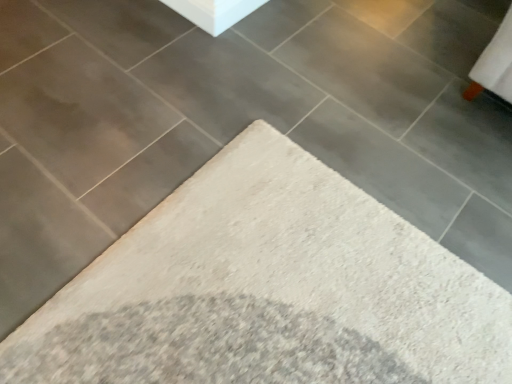
This screenshot has height=384, width=512. Identify the location of white shag rug at center. (268, 289).

What do you see at coordinates (268, 289) in the screenshot?
I see `white shag rug at center` at bounding box center [268, 289].

In order to face white smooth concrete at upper center, should I rotate leftwards or rightwards?

It's best to rotate left around 2.175 degrees.

Identify the location of white smooth concrete at upper center. Image resolution: width=512 pixels, height=384 pixels. (214, 12).

Image resolution: width=512 pixels, height=384 pixels. What do you see at coordinates (214, 12) in the screenshot? I see `white smooth concrete at upper center` at bounding box center [214, 12].

Where is `white shag rug at center`? The width and height of the screenshot is (512, 384). white shag rug at center is located at coordinates (268, 289).

Which object is positioned more to the right, white shag rug at center or white smooth concrete at upper center?

From the viewer's perspective, white smooth concrete at upper center appears more on the right side.

Is the position of white shag rug at center less distant than that of white smooth concrete at upper center?

Yes, it is.

Does point (23, 378) lie behind point (169, 0)?

No, it is in front of (169, 0).

From the image's perspective, between white shag rug at center and white smooth concrete at upper center, which one is located above?

white smooth concrete at upper center.

Consider the image. From a real-world perspective, is white shag rug at center positioned over white smooth concrete at upper center based on gravity?

Incorrect, from a real-world perspective, white shag rug at center is lower than white smooth concrete at upper center.

Does white shag rug at center have a greater width compared to white smooth concrete at upper center?

Correct, the width of white shag rug at center exceeds that of white smooth concrete at upper center.

Between white shag rug at center and white smooth concrete at upper center, which one has less height?

Standing shorter between the two is white shag rug at center.

Which of these two, white shag rug at center or white smooth concrete at upper center, is smaller?

Smaller between the two is white smooth concrete at upper center.

Is white shag rug at center located outside white smooth concrete at upper center?

That's correct, white shag rug at center is outside of white smooth concrete at upper center.

Are white shag rug at center and white smooth concrete at upper center beside each other?

No, white shag rug at center is not touching white smooth concrete at upper center.

Could you tell me if white shag rug at center is facing white smooth concrete at upper center?

No, white shag rug at center is not turned towards white smooth concrete at upper center.

How many degrees apart are the facing directions of white shag rug at center and white smooth concrete at upper center?

They differ by 1.57 degrees in their facing directions.

Locate an element on the screen. concrete behind the white shag rug at center is located at coordinates (214, 12).

Considering the relative positions of white smooth concrete at upper center and white shag rug at center in the image provided, is white smooth concrete at upper center to the left or to the right of white shag rug at center?

From the image, it's evident that white smooth concrete at upper center is to the right of white shag rug at center.

Is the position of white smooth concrete at upper center less distant than that of white shag rug at center?

No, white smooth concrete at upper center is behind white shag rug at center.

Is point (224, 5) closer to viewer compared to point (201, 341)?

No, it is behind (201, 341).

From the image's perspective, is white smooth concrete at upper center beneath white shag rug at center?

No.

From a real-world perspective, who is located lower, white smooth concrete at upper center or white shag rug at center?

From a 3D spatial view, white shag rug at center is below.

Considering the relative sizes of white smooth concrete at upper center and white shag rug at center in the image provided, is white smooth concrete at upper center thinner than white shag rug at center?

Correct, the width of white smooth concrete at upper center is less than that of white shag rug at center.

Considering the relative sizes of white smooth concrete at upper center and white shag rug at center in the image provided, is white smooth concrete at upper center shorter than white shag rug at center?

In fact, white smooth concrete at upper center may be taller than white shag rug at center.

Can you confirm if white smooth concrete at upper center is bigger than white shag rug at center?

Incorrect, white smooth concrete at upper center is not larger than white shag rug at center.

Is white smooth concrete at upper center not within white shag rug at center?

white smooth concrete at upper center lies outside white shag rug at center's area.

Are white smooth concrete at upper center and white shag rug at center beside each other?

No.

Is white smooth concrete at upper center positioned with its back to white shag rug at center?

No.

Measure the distance from white smooth concrete at upper center to white shag rug at center.

A distance of 3.37 feet exists between white smooth concrete at upper center and white shag rug at center.

Locate an element on the screen. The image size is (512, 384). furniture lying below the white smooth concrete at upper center (from the image's perspective) is located at coordinates (268, 289).

Locate an element on the screen. concrete lying behind the white shag rug at center is located at coordinates (214, 12).

Where is `furniture below the white smooth concrete at upper center (from a real-world perspective)`? The width and height of the screenshot is (512, 384). furniture below the white smooth concrete at upper center (from a real-world perspective) is located at coordinates (268, 289).